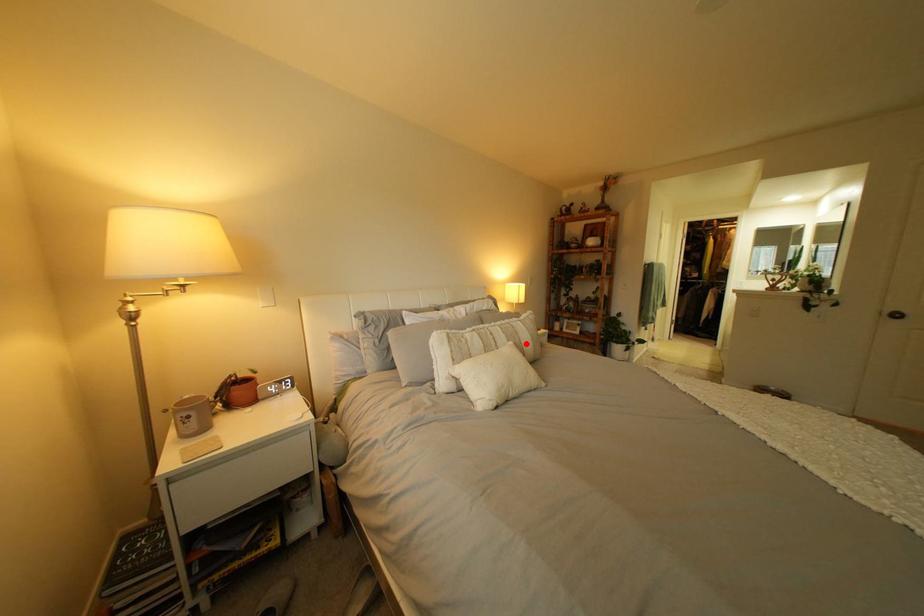
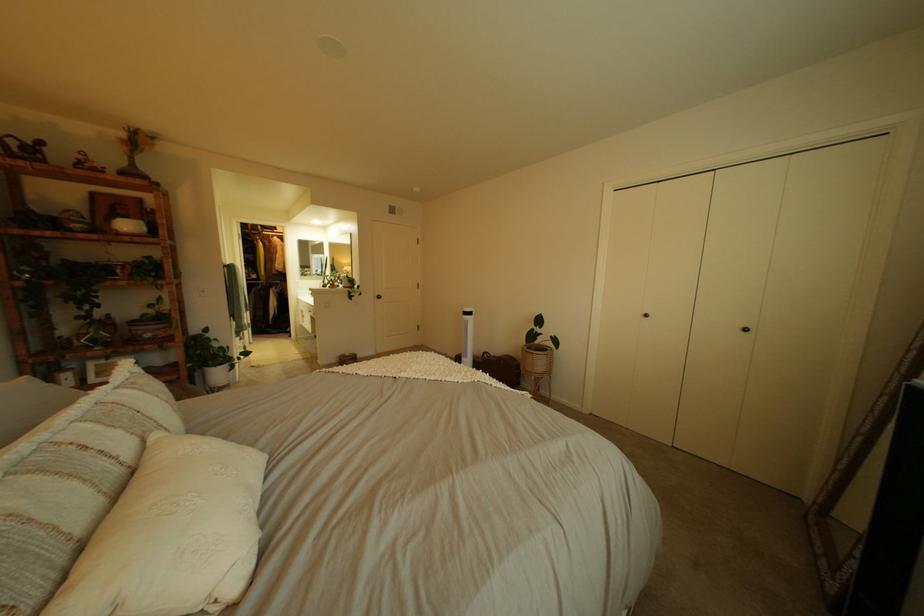
Find the pixel in the second image that matches the highlighted location in the first image.

(172, 436)